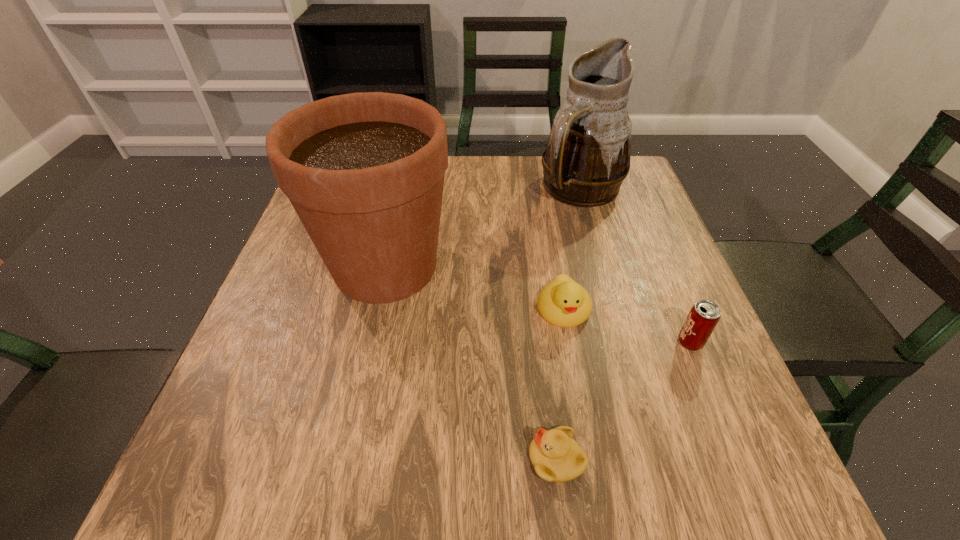
What are the coordinates of `vacant space that satisfies the following two spatial constraints: 1. on the face of the taller duckling; 2. on the front-facing side of the nearer duckling` in the screenshot? It's located at (590, 459).

I want to click on vacant region that satisfies the following two spatial constraints: 1. from the spout of the beer can; 2. on the left side of the farthest object, so point(625,342).

Identify the location of vacant area that satisfies the following two spatial constraints: 1. on the front side of the flowerpot; 2. on the right side of the beer can. This screenshot has width=960, height=540. (369, 342).

Find the location of a particular element. free point that satisfies the following two spatial constraints: 1. on the face of the taller duckling; 2. on the front-facing side of the nearest object is located at coordinates (590, 459).